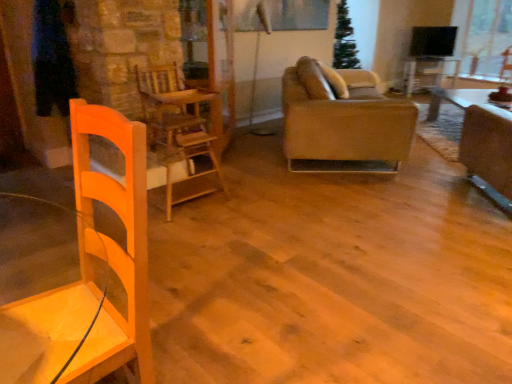
Question: Does matte glass window screen at upper center have a lesser height compared to wooden chair at center?

Choices:
 (A) yes
 (B) no

Answer: (A)

Question: From the image's perspective, is matte glass window screen at upper center over wooden chair at center?

Choices:
 (A) no
 (B) yes

Answer: (B)

Question: Is matte glass window screen at upper center thinner than wooden chair at center?

Choices:
 (A) no
 (B) yes

Answer: (B)

Question: Is matte glass window screen at upper center far from wooden chair at center?

Choices:
 (A) yes
 (B) no

Answer: (A)

Question: Is matte glass window screen at upper center oriented away from wooden chair at center?

Choices:
 (A) no
 (B) yes

Answer: (A)

Question: In terms of height, does leather couch at center look taller or shorter compared to wooden chair at center?

Choices:
 (A) short
 (B) tall

Answer: (A)

Question: Is leather couch at center bigger or smaller than wooden chair at center?

Choices:
 (A) big
 (B) small

Answer: (A)

Question: Looking at their shapes, would you say leather couch at center is wider or thinner than wooden chair at center?

Choices:
 (A) thin
 (B) wide

Answer: (B)

Question: Is point (305, 158) closer or farther from the camera than point (168, 99)?

Choices:
 (A) closer
 (B) farther

Answer: (B)

Question: Is wooden chair at center inside the boundaries of leather couch at center, or outside?

Choices:
 (A) inside
 (B) outside

Answer: (B)

Question: In terms of width, does wooden chair at center look wider or thinner when compared to leather couch at center?

Choices:
 (A) thin
 (B) wide

Answer: (A)

Question: In the image, is wooden chair at center positioned in front of or behind leather couch at center?

Choices:
 (A) behind
 (B) front

Answer: (B)

Question: Considering the positions of wooden chair at center and leather couch at center in the image, is wooden chair at center taller or shorter than leather couch at center?

Choices:
 (A) short
 (B) tall

Answer: (B)

Question: Looking at the image, does matte glass window screen at upper center seem bigger or smaller compared to wooden chair at center?

Choices:
 (A) big
 (B) small

Answer: (B)

Question: Is matte glass window screen at upper center to the left or to the right of wooden chair at center in the image?

Choices:
 (A) left
 (B) right

Answer: (B)